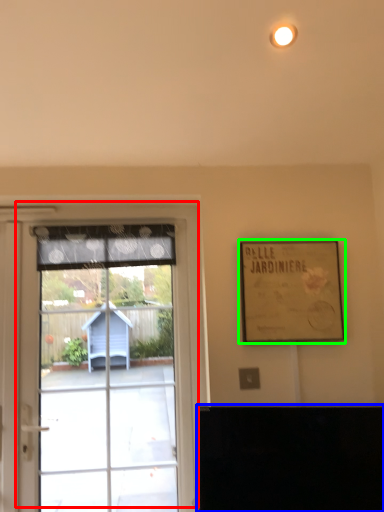
Question: Which object is positioned farthest from window (highlighted by a red box)? Select from furniture (highlighted by a blue box) and picture frame (highlighted by a green box).

Choices:
 (A) furniture
 (B) picture frame

Answer: (A)